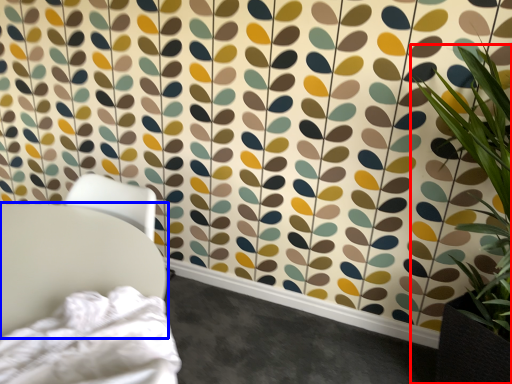
Question: Which of the following is the closest to the observer, houseplant (highlighted by a red box) or furniture (highlighted by a blue box)?

Choices:
 (A) houseplant
 (B) furniture

Answer: (A)